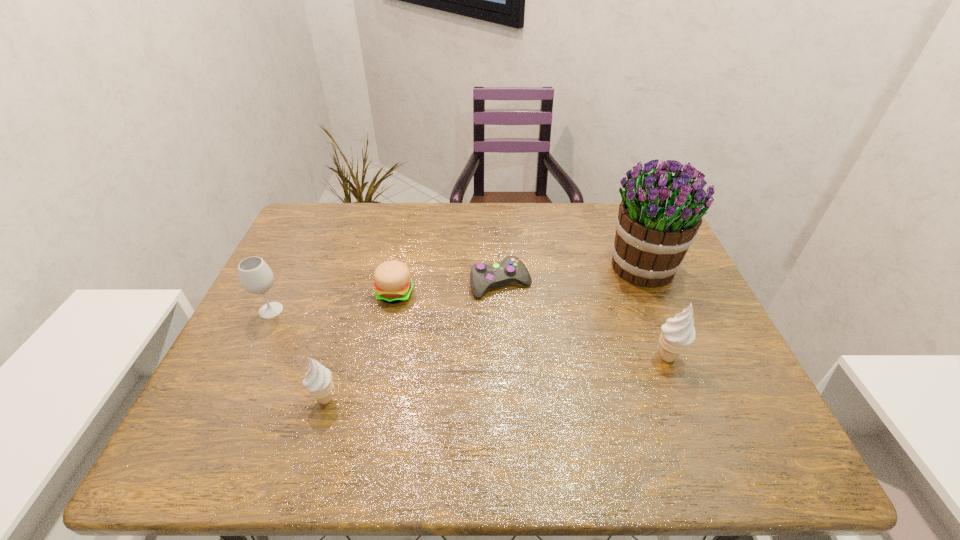
To make them evenly spaced by inserting another icecream among them, please locate a vacant spot for this new icecream. Please provide its 2D coordinates. Your answer should be formatted as a tuple, i.e. [(x, y)], where the tuple contains the x and y coordinates of a point satisfying the conditions above.

[(504, 377)]